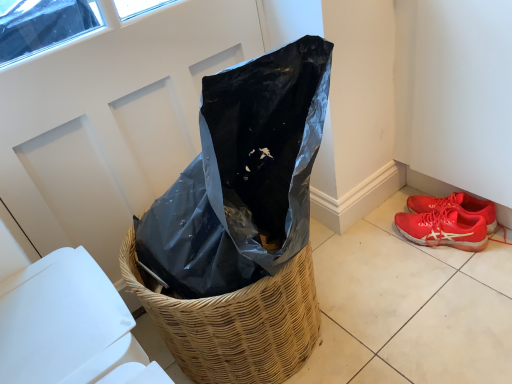
Locate an element on the screen. This screenshot has height=384, width=512. free space in front of shiny red sneakers at lower right is located at coordinates (x=459, y=289).